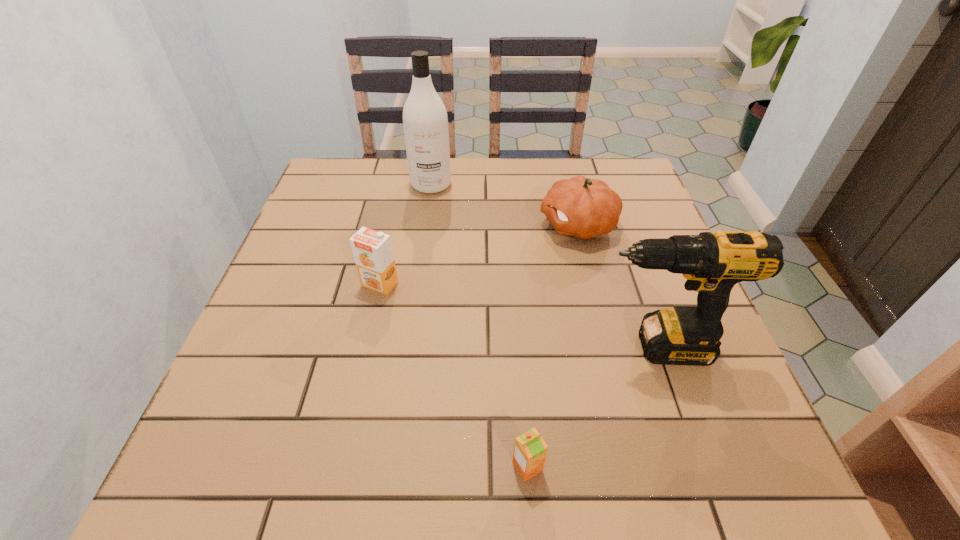
The image size is (960, 540). I want to click on free spot located 0.110m at the tip of the second tallest object, so click(537, 347).

Image resolution: width=960 pixels, height=540 pixels. What are the coordinates of `vacant space located at the tip of the second tallest object` in the screenshot? It's located at (537, 347).

Find the location of a particular element. vacant space located at the tip of the second tallest object is located at coordinates (404, 347).

Find the location of `free space located on the front face of the pumpkin`. free space located on the front face of the pumpkin is located at coordinates (402, 225).

Image resolution: width=960 pixels, height=540 pixels. What are the coordinates of `free space located on the front face of the pumpkin` in the screenshot? It's located at (410, 225).

Find the location of a particular element. Image resolution: width=960 pixels, height=540 pixels. free space located on the front face of the pumpkin is located at coordinates (418, 225).

The height and width of the screenshot is (540, 960). I want to click on free space located 0.070m on the right of the taller orange juice, so click(x=429, y=284).

The height and width of the screenshot is (540, 960). In order to click on free location located on the back of the third object from left to right in this screenshot , I will do `click(514, 287)`.

I want to click on shampoo located in the far edge section of the desktop, so click(x=425, y=121).

Find the location of a particular element. pumpkin located at the far edge is located at coordinates (581, 207).